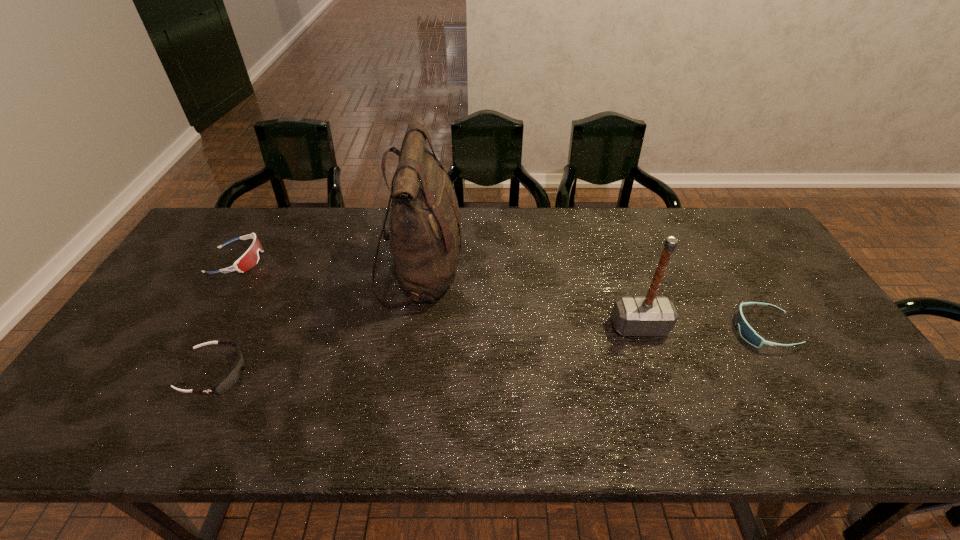
I want to click on free region at the right edge, so click(x=806, y=349).

Where is `free space at the far left corner of the desktop`? The width and height of the screenshot is (960, 540). free space at the far left corner of the desktop is located at coordinates (199, 248).

Find the location of a particular element. This screenshot has width=960, height=540. free space that is in between the tallest object and the rightmost object is located at coordinates (593, 302).

The image size is (960, 540). What are the coordinates of `empty space that is in between the farthest goggles and the third object from left to right` in the screenshot? It's located at pyautogui.click(x=329, y=266).

Identify the location of free space between the backpack and the rightmost goggles. (593, 302).

Image resolution: width=960 pixels, height=540 pixels. In order to click on free area in between the rightmost object and the third tallest object in this screenshot , I will do `click(500, 295)`.

You are a GUI agent. You are given a task and a screenshot of the screen. Output one action in this format:
    pyautogui.click(x=<x>, y=<y>)
    Task: Click on the vacant space in between the tallest object and the hammer
    
    Given the screenshot: What is the action you would take?
    pyautogui.click(x=531, y=300)

Locate an element on the screen. Image resolution: width=960 pixels, height=540 pixels. unoccupied area between the rightmost object and the tallest goggles is located at coordinates (500, 295).

You are a GUI agent. You are given a task and a screenshot of the screen. Output one action in this format:
    pyautogui.click(x=<x>, y=<y>)
    Task: Click on the object that is the fourth closest to the backpack
    
    Given the screenshot: What is the action you would take?
    pyautogui.click(x=746, y=331)

Image resolution: width=960 pixels, height=540 pixels. Find the location of `the third closest object to the farthest goggles`. the third closest object to the farthest goggles is located at coordinates (650, 315).